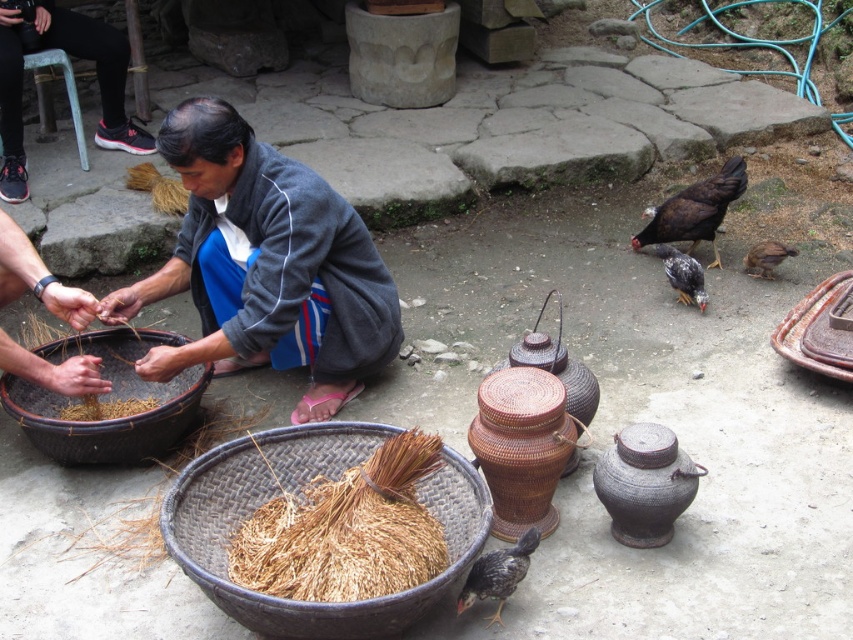
Question: Can you confirm if gray woven fabric at center is smaller than woven brown pot at center?

Choices:
 (A) yes
 (B) no

Answer: (B)

Question: Estimate the real-world distances between objects in this image. Which object is closer to the woven brown pot at center?

Choices:
 (A) brown woven basket at lower left
 (B) gray woven fabric at center
 (C) brown straw at lower left
 (D) brown woven basket at lower center

Answer: (D)

Question: Can you confirm if brown woven basket at lower center is thinner than brown woven basket at lower left?

Choices:
 (A) yes
 (B) no

Answer: (B)

Question: Among these objects, which one is nearest to the camera?

Choices:
 (A) brown woven basket at lower left
 (B) brown woven basket at lower center
 (C) woven brown pot at center

Answer: (B)

Question: Which of the following is the closest to the observer?

Choices:
 (A) gray woven fabric at center
 (B) brown straw at lower left
 (C) brown woven basket at lower center
 (D) brown woven basket at lower left

Answer: (C)

Question: Is brown woven basket at lower center positioned at the back of brown woven basket at lower left?

Choices:
 (A) yes
 (B) no

Answer: (B)